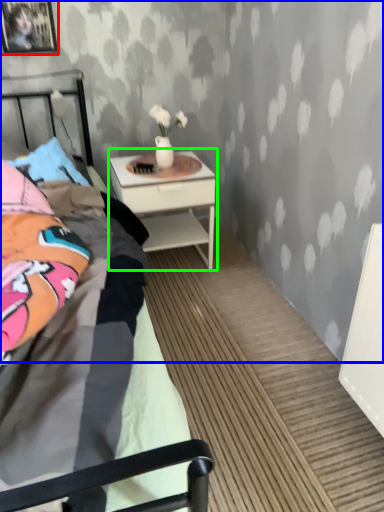
Question: Estimate the real-world distances between objects in this image. Which object is closer to picture frame (highlighted by a red box), backdrop (highlighted by a blue box) or nightstand (highlighted by a green box)?

Choices:
 (A) backdrop
 (B) nightstand

Answer: (A)